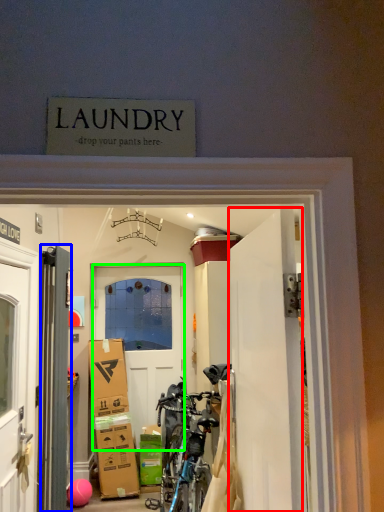
Question: Which is nearer to the door (highlighted by a red box)? door (highlighted by a blue box) or door (highlighted by a green box).

Choices:
 (A) door
 (B) door

Answer: (A)